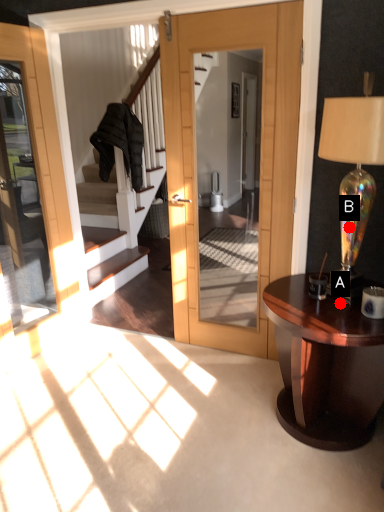
Question: Two points are circled on the image, labeled by A and B beside each circle. Which point appears closest to the camera in this image?

Choices:
 (A) A is closer
 (B) B is closer

Answer: (B)